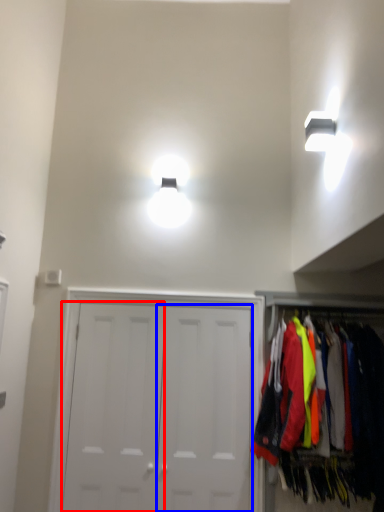
Question: Which object appears closest to the camera in this image, door (highlighted by a red box) or door (highlighted by a blue box)?

Choices:
 (A) door
 (B) door

Answer: (B)